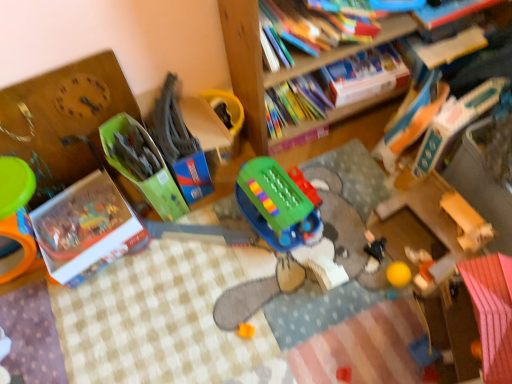
Locate an element on the screen. The height and width of the screenshot is (384, 512). free spot in front of green plastic toy at center, which ranks as the 2th toy in left-to-right order is located at coordinates (206, 231).